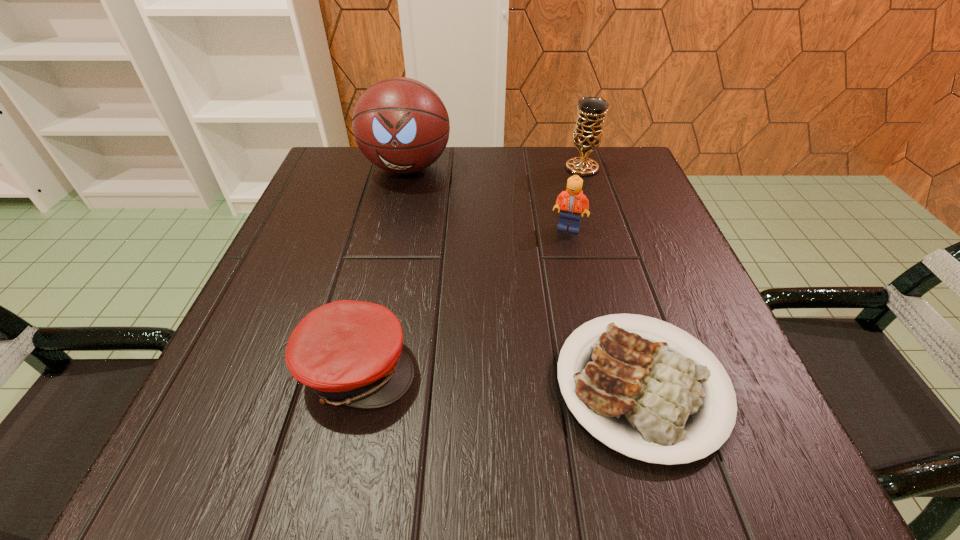
Locate an element on the screen. The width and height of the screenshot is (960, 540). free point between the basketball and the plate is located at coordinates (524, 276).

Where is `vacant area that lies between the basketball and the third nearest object`? Image resolution: width=960 pixels, height=540 pixels. vacant area that lies between the basketball and the third nearest object is located at coordinates (488, 198).

Identify the location of empty space that is in between the Lego and the shortest object. (605, 307).

At what (x,y) coordinates should I click in order to perform the action: click on blank region between the third farthest object and the basketball. Please return your answer as a coordinate pair (x, y). Looking at the image, I should click on (488, 198).

Find the location of `vacant space in between the shortest object and the third shortest object`. vacant space in between the shortest object and the third shortest object is located at coordinates (605, 307).

Locate an element on the screen. The image size is (960, 540). vacant area that lies between the cap and the plate is located at coordinates (499, 377).

Locate an element on the screen. The image size is (960, 540). the fourth closest object to the cap is located at coordinates (588, 131).

Locate an element on the screen. object that is the closest to the tallest object is located at coordinates (572, 201).

This screenshot has width=960, height=540. In order to click on free spot that satisfies the following two spatial constraints: 1. on the front side of the basketball; 2. on the left side of the chalice in this screenshot , I will do [x=407, y=168].

The image size is (960, 540). Identify the location of free point that satisfies the following two spatial constraints: 1. on the front side of the tallest object; 2. on the front of the fourth tallest object with an emblem. (361, 368).